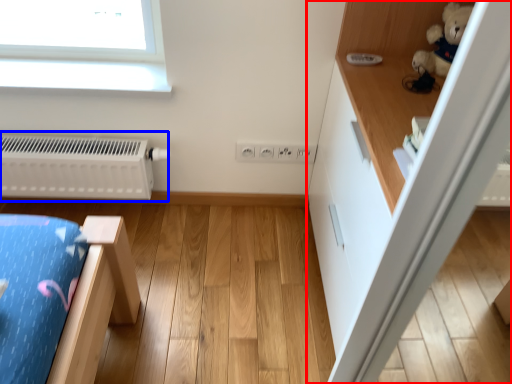
Question: Which object is closer to the camera taking this photo, dresser (highlighted by a red box) or radiator (highlighted by a blue box)?

Choices:
 (A) dresser
 (B) radiator

Answer: (A)